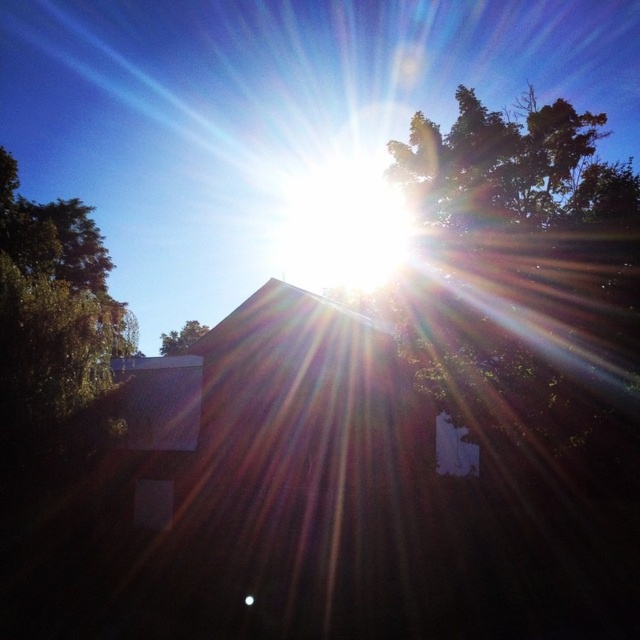
You are standing in the outdoor scene and want to find the green leafy tree at left. According to the coordinates provided, where should you look relative to the center of the image?

The green leafy tree at left is located at coordinates point [52,308], which means it is positioned to the left and slightly above the center of the image.

You are standing in the outdoor scene and want to shade yourself from the sun. Which of the two green leafy trees can provide more overhead shade? The green leafy tree at upper right or the green leafy tree at center?

The green leafy tree at upper right is above the green leafy tree at center, so it can provide more overhead shade.